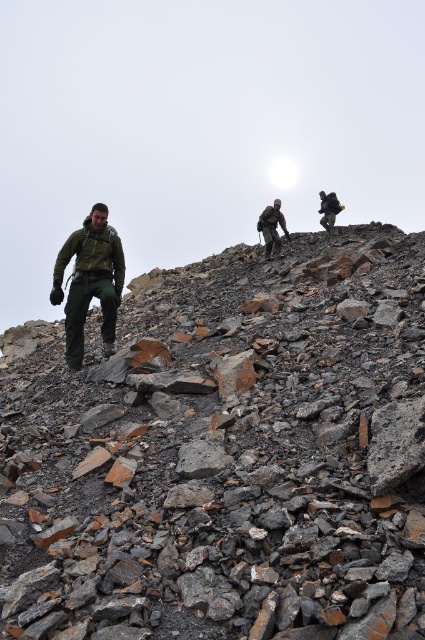
Who is more forward, (201, 493) or (74, 362)?

Point (201, 493)

What do you see at coordinates (227, 456) in the screenshot? I see `gray rocky hillside at upper center` at bounding box center [227, 456].

Does point (217, 621) lie behind point (110, 276)?

No, it is not.

This screenshot has height=640, width=425. In order to click on gray rocky hillside at upper center in this screenshot , I will do `click(227, 456)`.

Does gray rocky hillside at upper center have a greater height compared to dark green jacket at upper center?

Yes, gray rocky hillside at upper center is taller than dark green jacket at upper center.

Measure the distance between point (357, 392) and camera.

→ Point (357, 392) is 4.74 meters away from camera.

Does point (210, 582) lie in front of point (334, 205)?

That is True.

Find the location of a particular element. gray rocky hillside at upper center is located at coordinates (227, 456).

Is dark green jacket at center bigger than dark green jacket at upper center?

Yes, dark green jacket at center is bigger than dark green jacket at upper center.

Does dark green jacket at center lie in front of dark green jacket at upper center?

That is True.

Does point (269, 232) come in front of point (328, 204)?

Yes, it is in front of point (328, 204).

Find the location of a particular element. The width and height of the screenshot is (425, 640). dark green jacket at center is located at coordinates (272, 227).